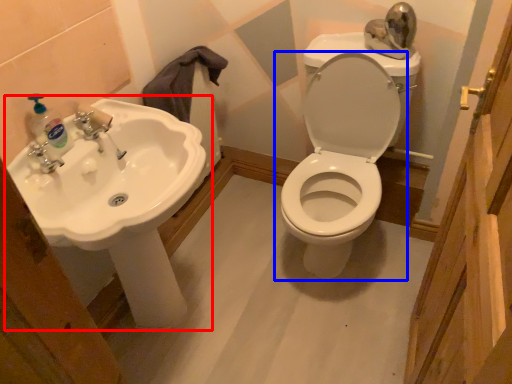
Question: Which of the following is the closest to the observer, sink (highlighted by a red box) or toilet (highlighted by a blue box)?

Choices:
 (A) sink
 (B) toilet

Answer: (A)